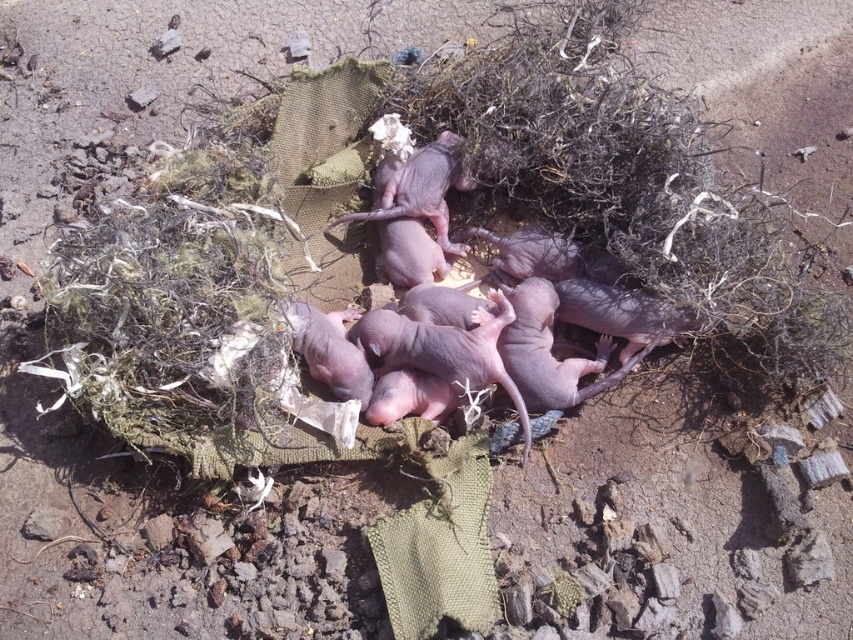
Does pink furless mice at center appear on the right side of pink smooth mouse at center?

Correct, you'll find pink furless mice at center to the right of pink smooth mouse at center.

Between pink furless mice at center and pink smooth mouse at center, which one appears on the left side from the viewer's perspective?

pink smooth mouse at center is more to the left.

Describe the element at coordinates (415, 202) in the screenshot. The width and height of the screenshot is (853, 640). I see `pink furless mice at center` at that location.

Find the location of a particular element. pink furless mice at center is located at coordinates (415, 202).